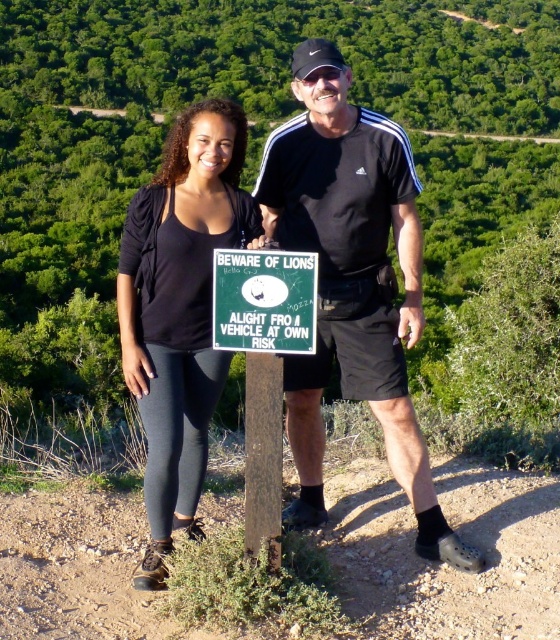
You are a hiker trying to determine which clothing item is covering more of the lower body between the black matte shorts at center and the black fabric top at center. Based on their positions, which one is covering more of the lower body?

The black matte shorts at center is positioned over the black fabric top at center, so it covers more of the lower body.

You are a photographer trying to capture both the black matte shorts at center and the black fabric top at center in the same frame. Based on their positions, which one should you adjust your camera to focus on first to ensure both are in the shot?

Since the black matte shorts at center are to the right of the black fabric top at center, you should focus on the black fabric top at center first to ensure both are included in the frame.

You are a photographer trying to capture both the black fabric top at center and the green plastic sign at center in a single frame. Given their heights, which object should you focus on first to ensure both are in the frame?

The black fabric top at center is taller than the green plastic sign at center, so you should focus on the black fabric top at center first to ensure both are in the frame.